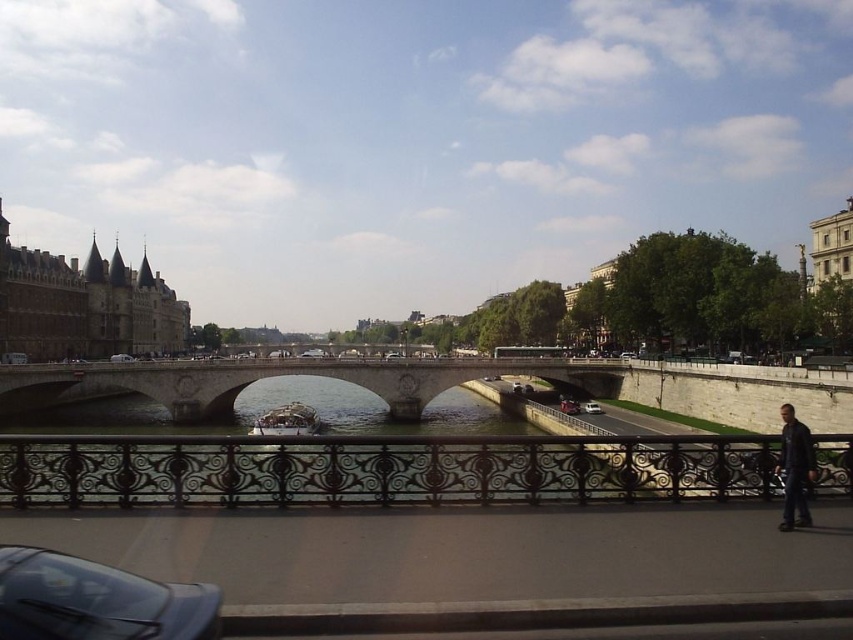
Can you confirm if black wrought iron railing at center is wider than metallic silver boat at center?

Indeed, black wrought iron railing at center has a greater width compared to metallic silver boat at center.

Does black wrought iron railing at center appear on the right side of metallic silver boat at center?

Indeed, black wrought iron railing at center is positioned on the right side of metallic silver boat at center.

Between point (375, 493) and point (312, 352), which one is positioned in front?

Point (375, 493)

Where is `black wrought iron railing at center`? black wrought iron railing at center is located at coordinates (380, 468).

Looking at this image, can you confirm if stone bridge at center is positioned to the left of dark blue leather jacket at lower right?

Yes, stone bridge at center is to the left of dark blue leather jacket at lower right.

Does stone bridge at center have a larger size compared to dark blue leather jacket at lower right?

Indeed, stone bridge at center has a larger size compared to dark blue leather jacket at lower right.

Does point (28, 412) come in front of point (787, 436)?

No, (28, 412) is behind (787, 436).

Locate an element on the screen. This screenshot has height=640, width=853. stone bridge at center is located at coordinates (279, 376).

Which is above, stone bridge at center or white glossy car at center?

stone bridge at center is above.

Between stone bridge at center and white glossy car at center, which one appears on the left side from the viewer's perspective?

stone bridge at center is more to the left.

Between point (604, 385) and point (589, 410), which one is positioned in front?

Point (589, 410) is in front.

Locate an element on the screen. The height and width of the screenshot is (640, 853). stone bridge at center is located at coordinates (279, 376).